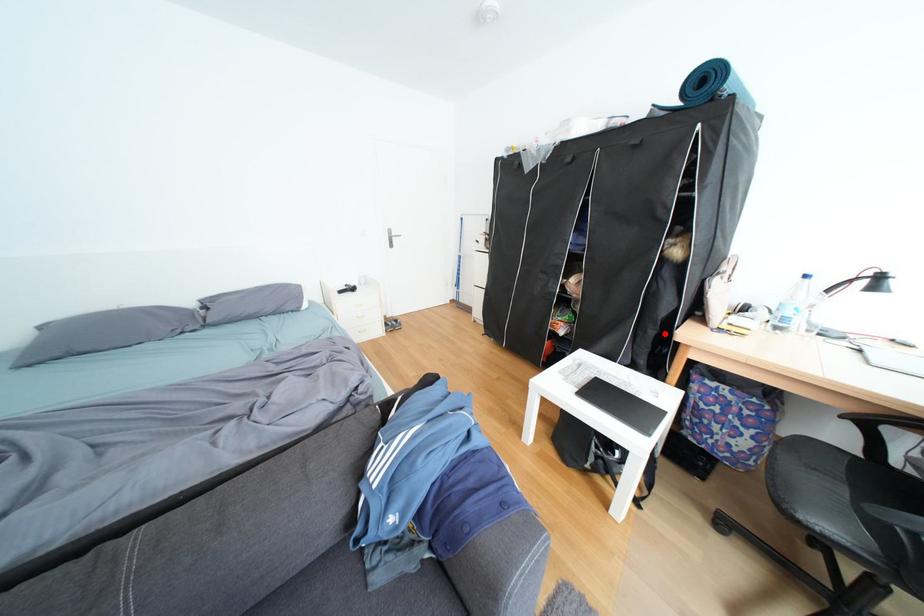
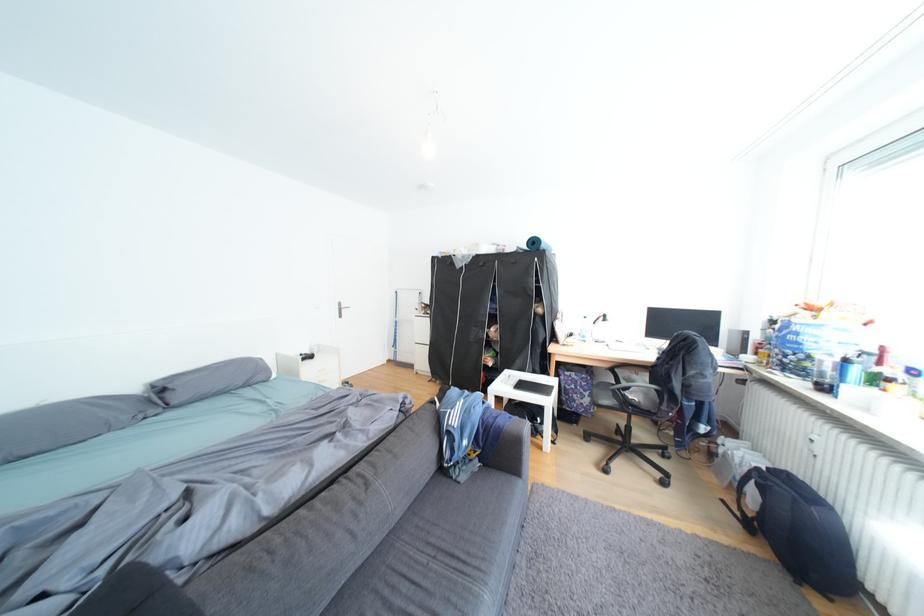
The point at the highlighted location is marked in the first image. Where is the corresponding point in the second image?

(552, 352)